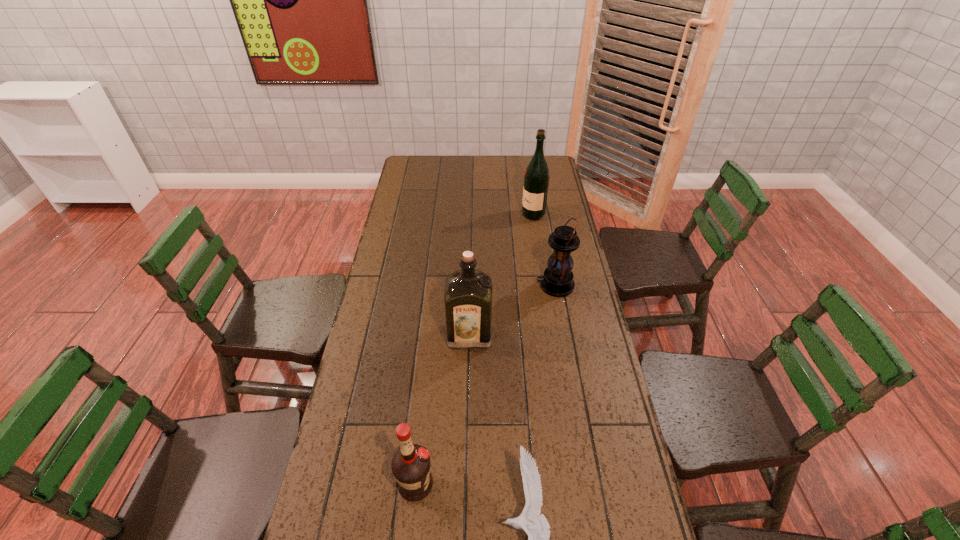
Identify which liquor is the second nearest to the rightmost liquor. Please provide its 2D coordinates. Your answer should be formatted as a tuple, i.e. [(x, y)], where the tuple contains the x and y coordinates of a point satisfying the conditions above.

[(410, 465)]

In order to click on free space that satisfies the following two spatial constraints: 1. above the second farthest object, indicating its light source; 2. on the label of the second object from left to right in this screenshot , I will do `click(564, 335)`.

Find the location of a particular element. This screenshot has height=540, width=960. free space that satisfies the following two spatial constraints: 1. on the label of the second liquor from left to right; 2. on the front and back of the leftmost liquor is located at coordinates (467, 485).